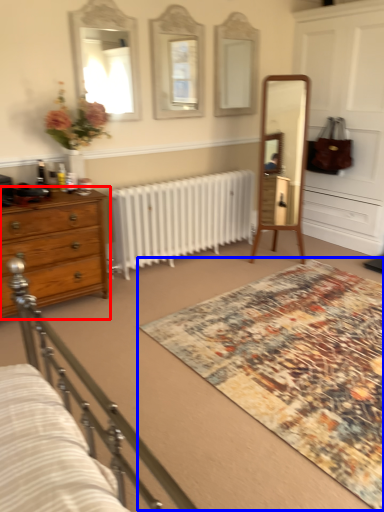
Question: Which object appears farthest to the camera in this image, chest of drawers (highlighted by a red box) or mat (highlighted by a blue box)?

Choices:
 (A) chest of drawers
 (B) mat

Answer: (A)